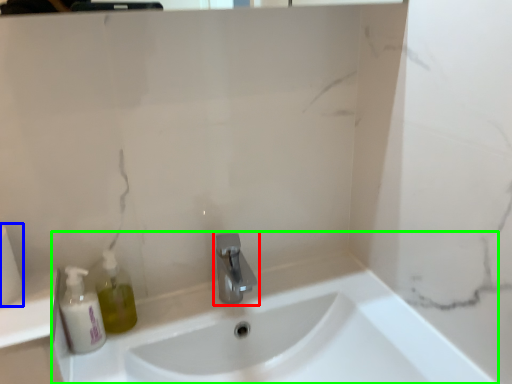
Question: Which object is positioned closest to tap (highlighted by a red box)? Select from toilet paper (highlighted by a blue box) and sink (highlighted by a green box).

Choices:
 (A) toilet paper
 (B) sink

Answer: (B)